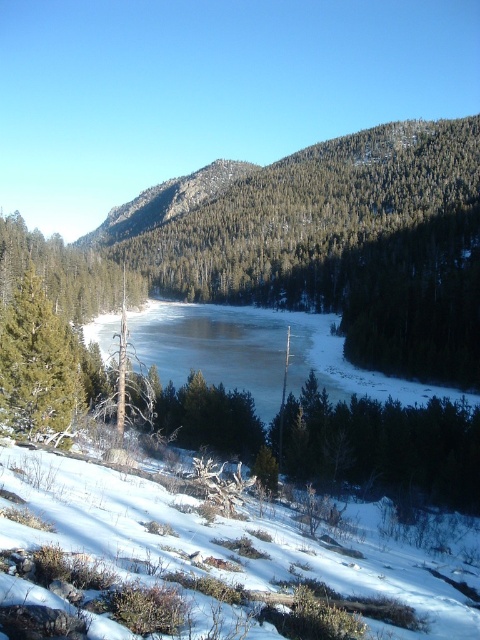
Does brown wood tree at center have a lesser height compared to green matte tree at left?

In fact, brown wood tree at center may be taller than green matte tree at left.

Is brown wood tree at center thinner than green matte tree at left?

No.

Is point (244, 298) farther from camera compared to point (20, 378)?

Yes, it is behind point (20, 378).

The image size is (480, 640). Find the location of `brown wood tree at center`. brown wood tree at center is located at coordinates (347, 244).

Is brown wood tree at center further to camera compared to white fluffy snow at lower left?

Yes, brown wood tree at center is behind white fluffy snow at lower left.

Which of these two, brown wood tree at center or white fluffy snow at lower left, stands taller?

With more height is brown wood tree at center.

Who is more distant from viewer, (x=396, y=371) or (x=323, y=572)?

Positioned behind is point (x=396, y=371).

Image resolution: width=480 pixels, height=640 pixels. In order to click on brown wood tree at center in this screenshot , I will do `click(347, 244)`.

Which is more to the left, white fluffy snow at lower left or green textured forest at center?

green textured forest at center is more to the left.

Where is `white fluffy snow at lower left`? The width and height of the screenshot is (480, 640). white fluffy snow at lower left is located at coordinates (197, 556).